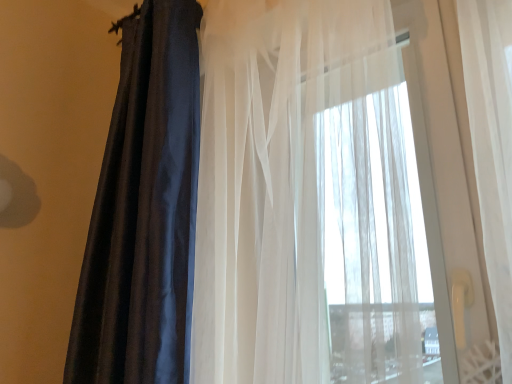
Where is `satin dark blue curtain at left`? This screenshot has width=512, height=384. satin dark blue curtain at left is located at coordinates click(x=144, y=210).

This screenshot has width=512, height=384. Describe the element at coordinates (144, 210) in the screenshot. I see `satin dark blue curtain at left` at that location.

This screenshot has height=384, width=512. Find the location of `satin dark blue curtain at left`. satin dark blue curtain at left is located at coordinates (144, 210).